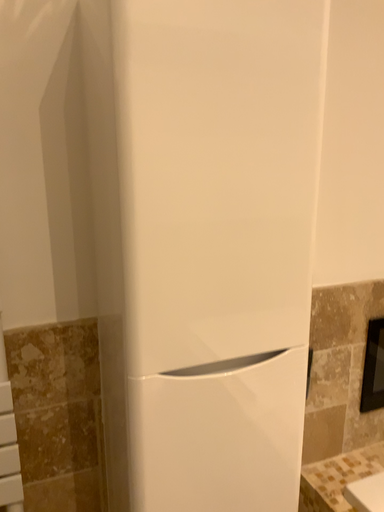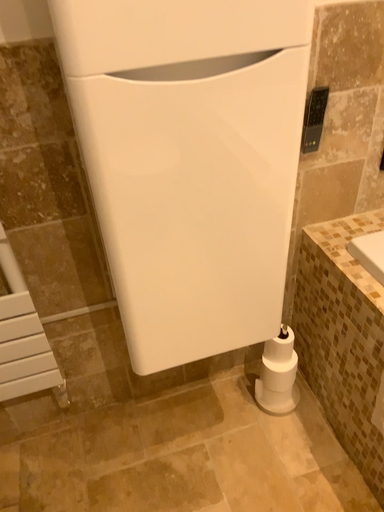
Question: Which way did the camera rotate in the video?

Choices:
 (A) rotated downward
 (B) rotated upward

Answer: (A)